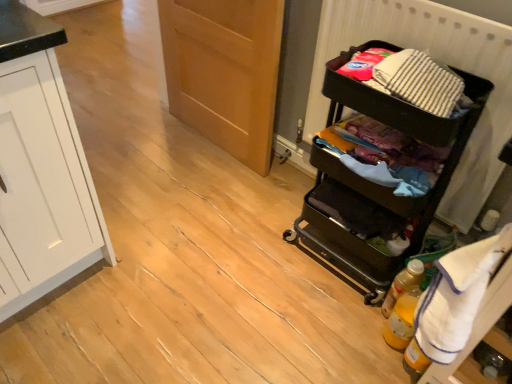
This screenshot has width=512, height=384. Find the location of `free space in front of translucent yellow bottle at lower right, arranged as the 2th bottle when viewed from the back`. free space in front of translucent yellow bottle at lower right, arranged as the 2th bottle when viewed from the back is located at coordinates (379, 369).